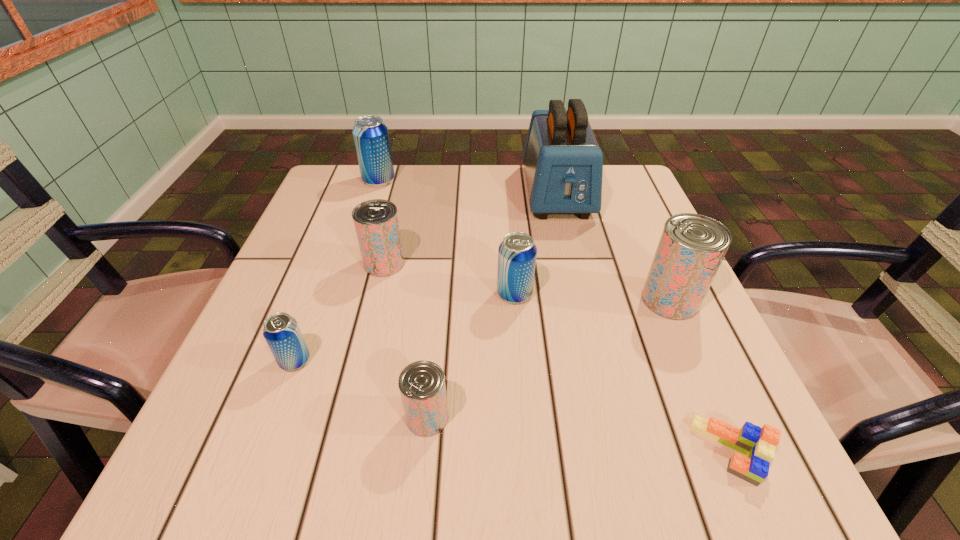
Identify the location of vacant space that satisfies the following two spatial constraints: 1. on the back side of the Lego; 2. on the left side of the rightmost beer can. The width and height of the screenshot is (960, 540). (665, 300).